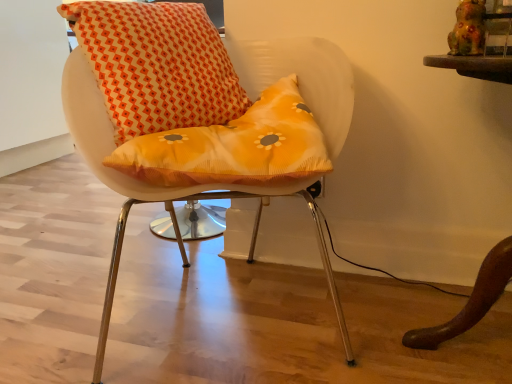
Question: From their relative heights in the image, would you say orange printed cushion at center is taller or shorter than matte white chair at center?

Choices:
 (A) tall
 (B) short

Answer: (B)

Question: Would you say orange printed cushion at center is to the left or to the right of matte white chair at center in the picture?

Choices:
 (A) right
 (B) left

Answer: (B)

Question: Looking at the image, does orange printed cushion at center seem bigger or smaller compared to matte white chair at center?

Choices:
 (A) big
 (B) small

Answer: (B)

Question: From the image's perspective, relative to orange printed cushion at center, is matte white chair at center above or below?

Choices:
 (A) above
 (B) below

Answer: (B)

Question: Looking at their shapes, would you say matte white chair at center is wider or thinner than orange printed cushion at center?

Choices:
 (A) wide
 (B) thin

Answer: (A)

Question: In the image, is matte white chair at center on the left side or the right side of orange printed cushion at center?

Choices:
 (A) right
 (B) left

Answer: (A)

Question: Would you say matte white chair at center is inside or outside orange printed cushion at center?

Choices:
 (A) inside
 (B) outside

Answer: (B)